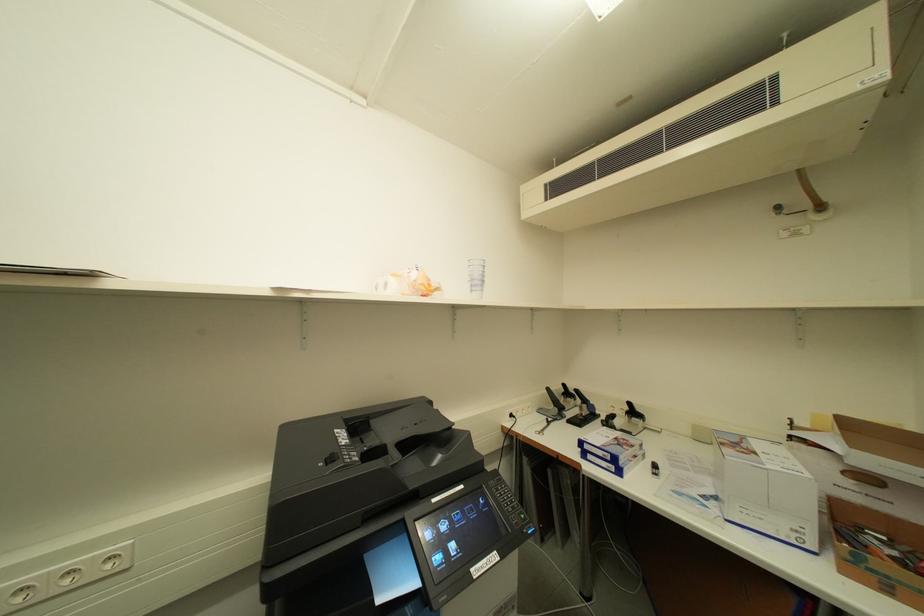
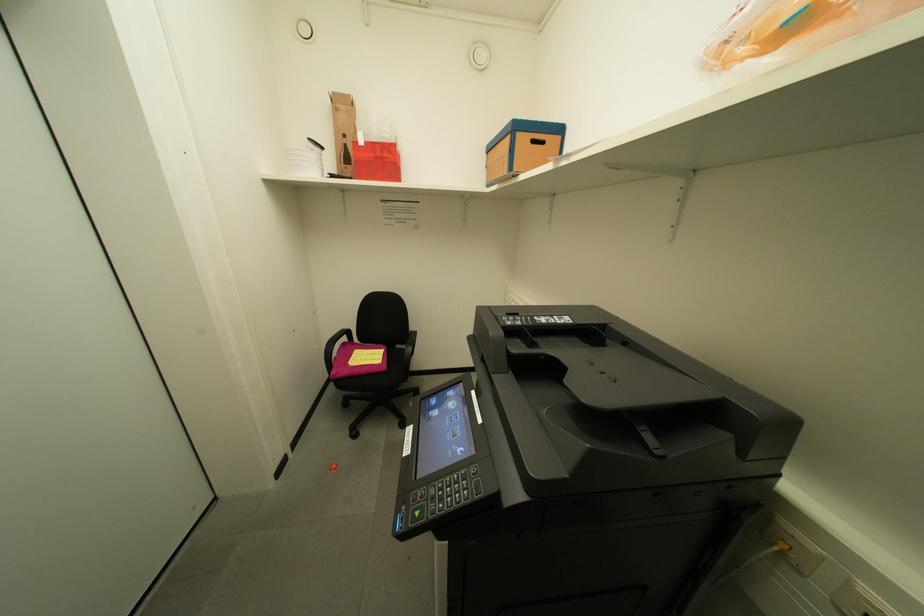
The images are taken continuously from a first-person perspective. In which direction is your viewpoint rotating?

The camera's rotation is toward left-down.